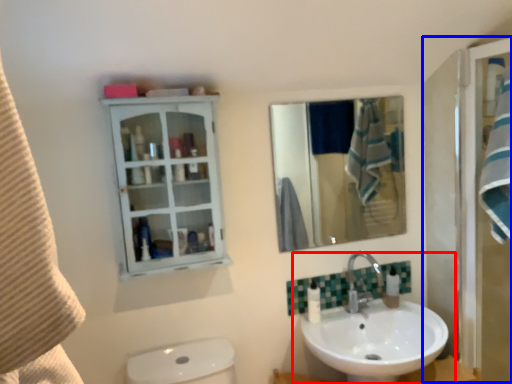
Question: Which point is further to the camera, sink (highlighted by a red box) or screen door (highlighted by a blue box)?

Choices:
 (A) sink
 (B) screen door

Answer: (B)